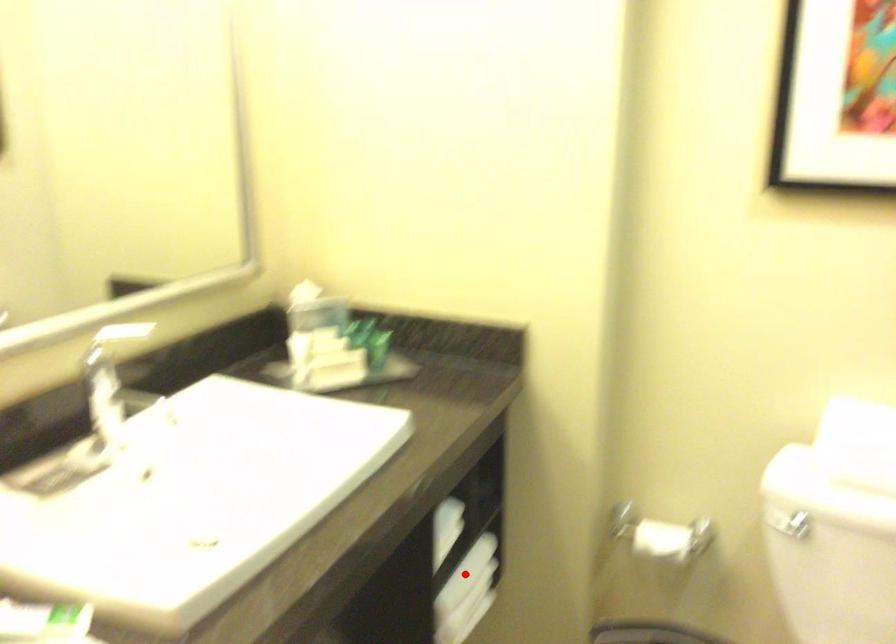
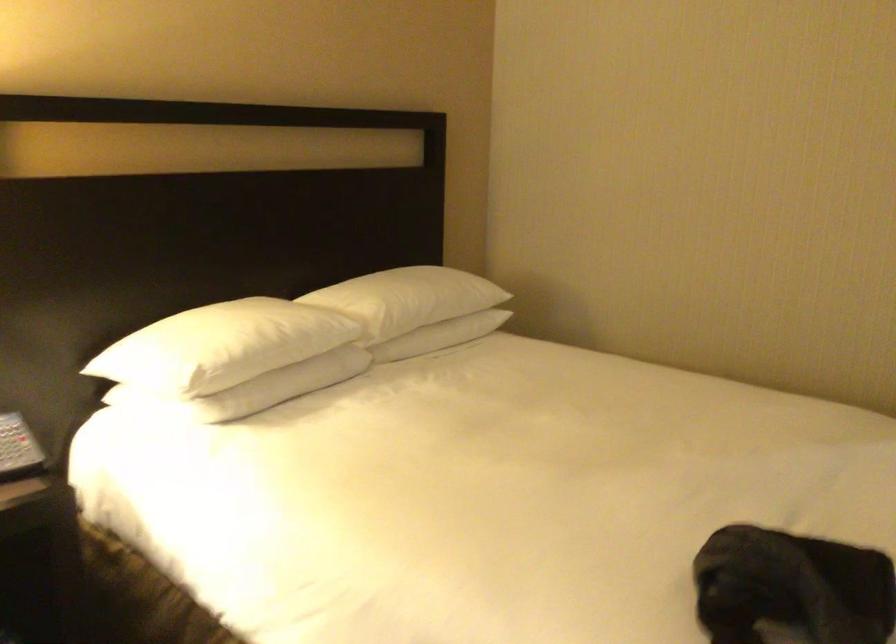
Question: I am providing you with two images of the same scene from different viewpoints. A red point is marked on the first image. Is the red point's position out of view in image 2?

Choices:
 (A) Yes
 (B) No

Answer: (A)